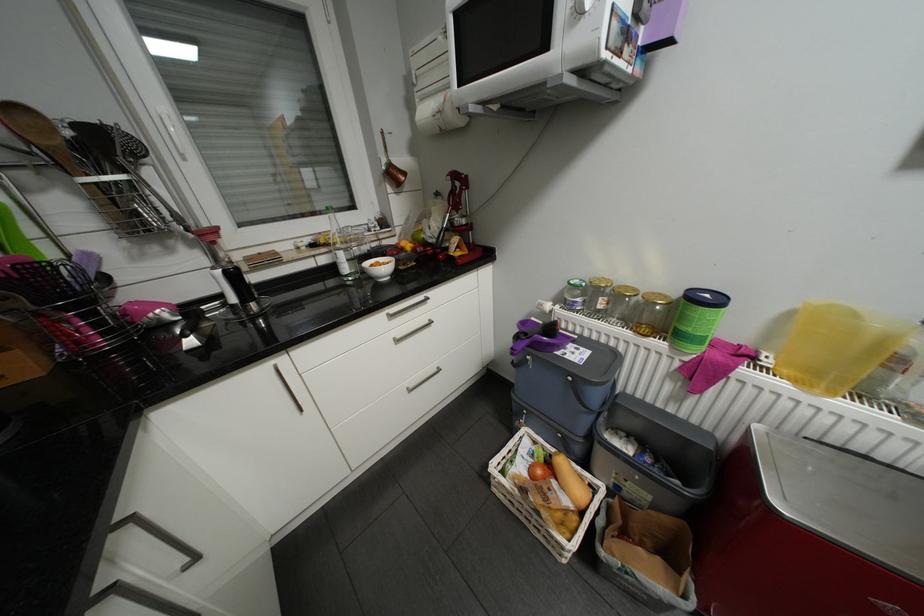
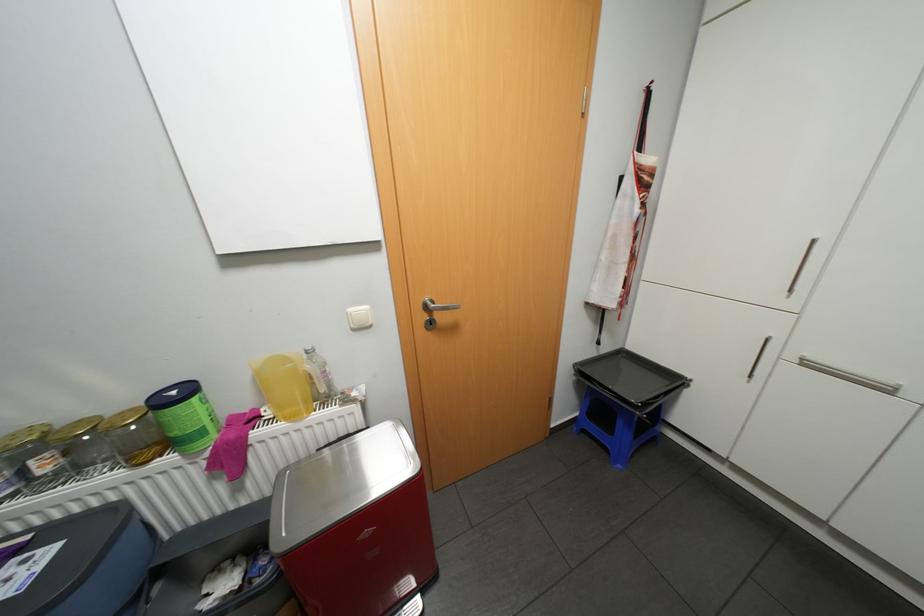
Locate, in the second image, the point that corresponds to (x=662, y=292) in the first image.

(128, 411)